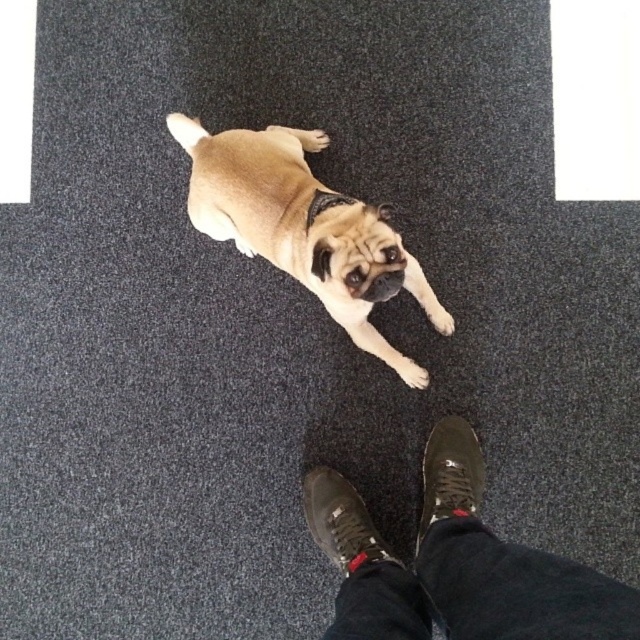
You are standing in the room and see two points marked in the image. Which point, point (493, 568) or point (404, 371), is closer to you?

Point (493, 568) is closer to the viewer than point (404, 371).

You are standing in the room where the pug dog is lying. You want to place a small toy exactly at the point with coordinates point (336, 282). If the toy is 0.5 feet in diameter, will it fit entirely within the area of the dark gray carpeted floor without overlapping the dog or the person?

The distance of point (336, 282) from camera is 3.82 feet. Since the toy is 0.5 feet in diameter, it will fit entirely within the area of the dark gray carpeted floor without overlapping the dog or the person as there are no other significant objects mentioned in the immediate vicinity.